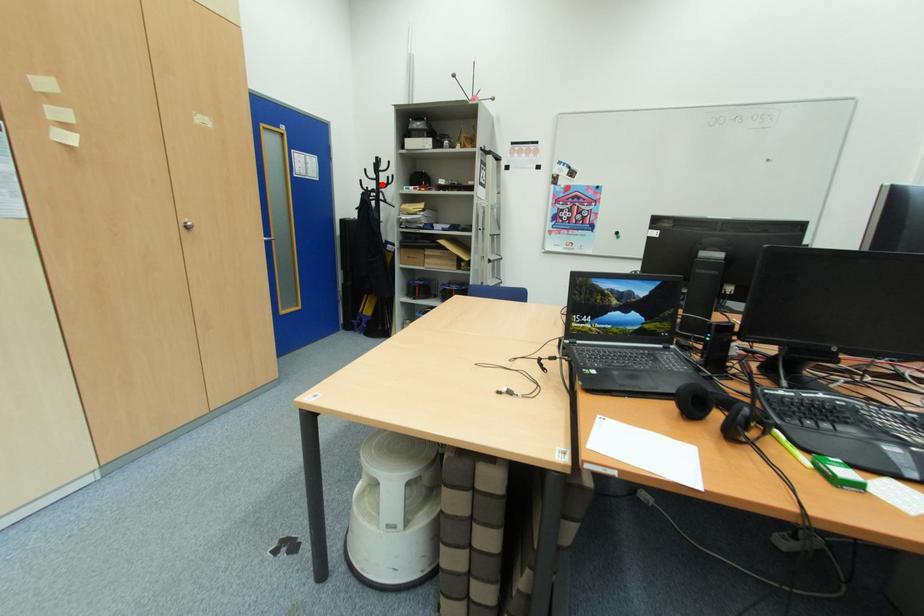
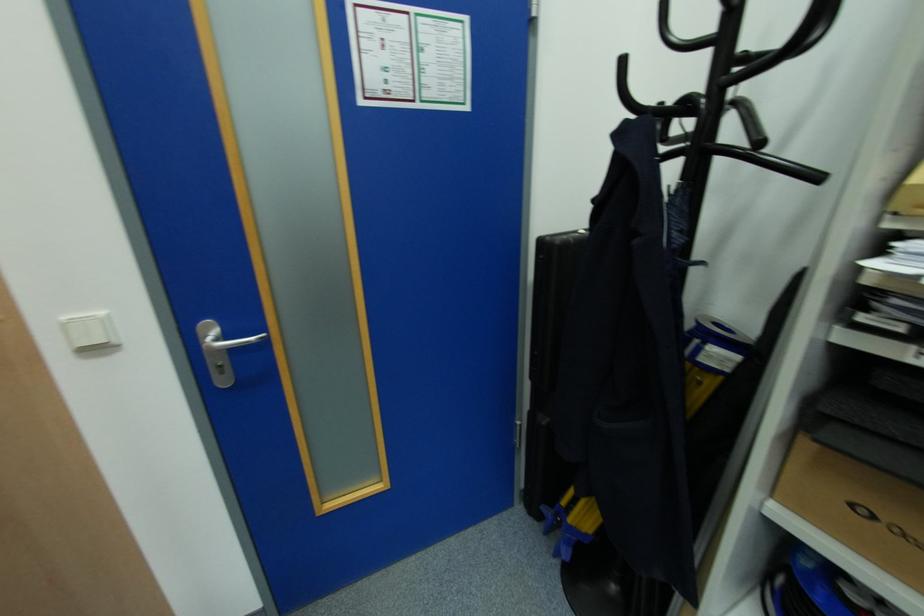
Question: I am providing you with two images of the same scene from different viewpoints. A red point is marked on the first image. Is the red point's position out of view in image 2?

Choices:
 (A) Yes
 (B) No

Answer: (B)